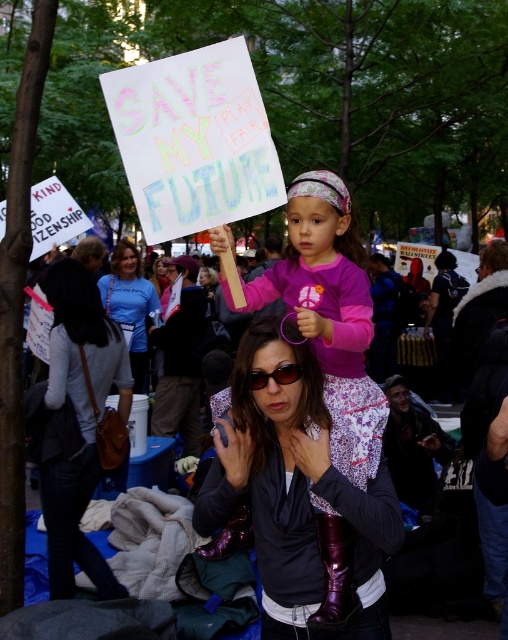
Question: Which point is farther from the camera taking this photo?

Choices:
 (A) (452, 406)
 (B) (139, 298)

Answer: (A)

Question: From the image, what is the correct spatial relationship of gray fabric jacket at center in relation to blue t-shirt at center?

Choices:
 (A) right
 (B) left

Answer: (A)

Question: Based on their relative distances, which object is nearer to the matte black sunglasses at center?

Choices:
 (A) blue t-shirt at center
 (B) pink fabric at center
 (C) gray fabric jacket at center
 (D) pink matte shirt at center

Answer: (D)

Question: Is pink matte shirt at center to the left of matte black sunglasses at center from the viewer's perspective?

Choices:
 (A) yes
 (B) no

Answer: (B)

Question: Is gray fabric jacket at center closer to the viewer compared to matte black sunglasses at center?

Choices:
 (A) no
 (B) yes

Answer: (A)

Question: Which is farther from the pink fabric at center?

Choices:
 (A) gray fabric jacket at center
 (B) blue t-shirt at center

Answer: (B)